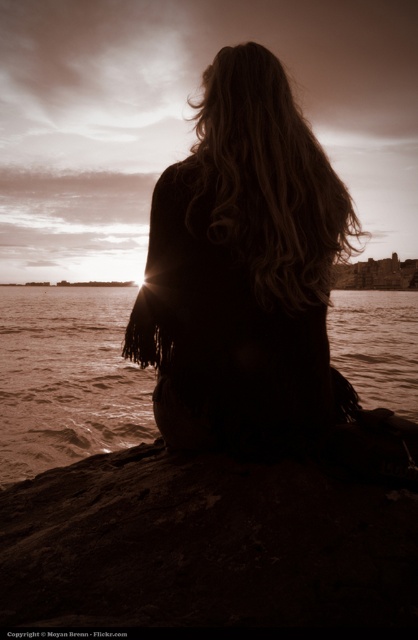
Question: Among these points, which one is nearest to the camera?

Choices:
 (A) (17, 451)
 (B) (213, 326)

Answer: (B)

Question: Is dark brown hair at center to the left of brown water at center from the viewer's perspective?

Choices:
 (A) yes
 (B) no

Answer: (A)

Question: Can you confirm if dark brown hair at center is positioned above brown water at center?

Choices:
 (A) yes
 (B) no

Answer: (B)

Question: Is dark brown hair at center positioned in front of brown water at center?

Choices:
 (A) no
 (B) yes

Answer: (B)